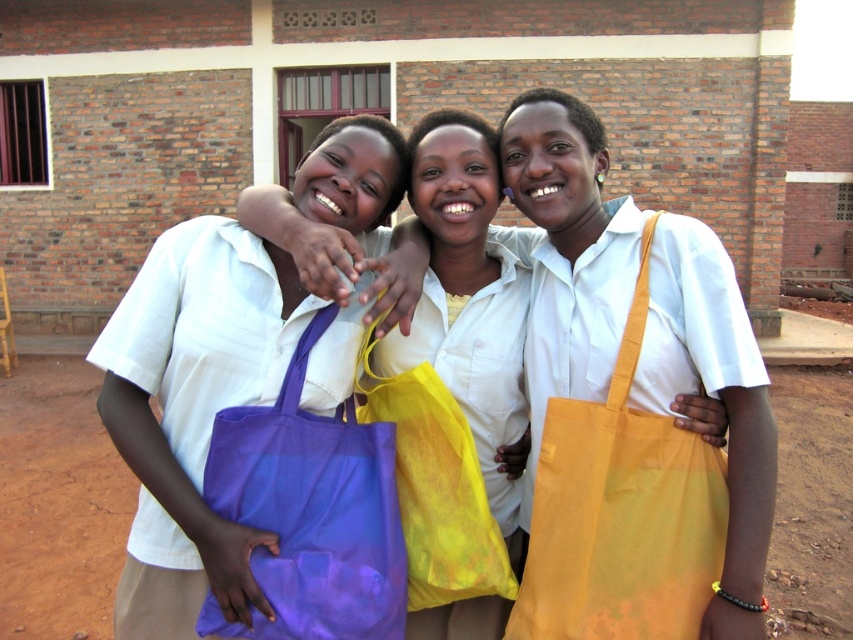
Question: Can you confirm if matte purple tote bag at left is positioned to the left of purple fabric bag at center?

Choices:
 (A) no
 (B) yes

Answer: (B)

Question: Which object appears closest to the camera in this image?

Choices:
 (A) yellow fabric tote at right
 (B) purple fabric bag at center
 (C) matte purple tote bag at left

Answer: (C)

Question: Which point is farther from the camera taking this photo?

Choices:
 (A) (376, 570)
 (B) (627, 561)
 (C) (186, 632)
 (D) (453, 515)

Answer: (D)

Question: Does yellow fabric tote at right have a lesser width compared to matte purple tote at center?

Choices:
 (A) yes
 (B) no

Answer: (B)

Question: Which point is farther from the camera taking this photo?

Choices:
 (A) (694, 596)
 (B) (563, 584)
 (C) (442, 592)

Answer: (C)

Question: Can you confirm if matte purple tote bag at left is bigger than purple fabric bag at center?

Choices:
 (A) no
 (B) yes

Answer: (B)